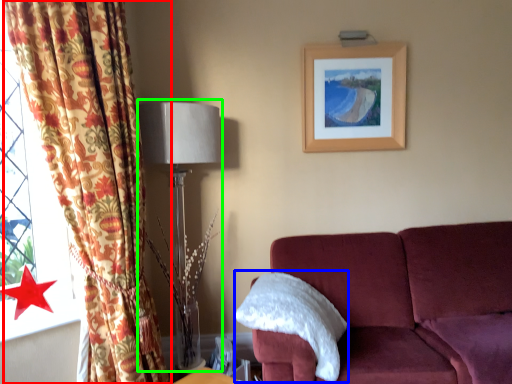
Question: Based on their relative distances, which object is nearer to curtain (highlighted by a red box)? Choose from pillow (highlighted by a blue box) and table lamp (highlighted by a green box).

Choices:
 (A) pillow
 (B) table lamp

Answer: (B)